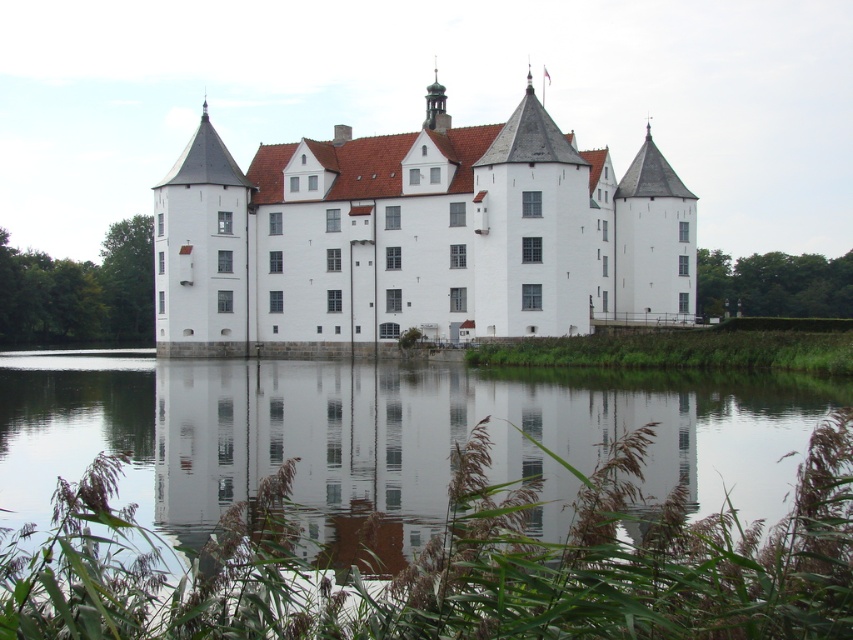
You are standing on the dock and see the transparent glass water at center and the white stone castle at center. Which object is positioned to the left of the other?

The transparent glass water at center is to the left of the white stone castle at center.

You are standing on the dock and looking at the transparent glass water at center and the white stone castle at center. Which object appears taller from your viewpoint?

The white stone castle at center appears taller than the transparent glass water at center because the water has a lesser height compared to the castle.